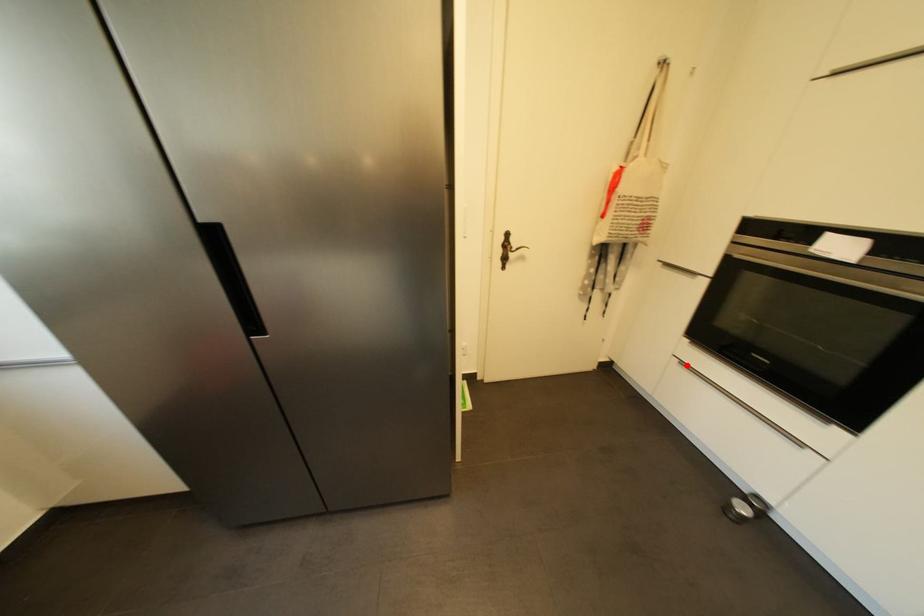
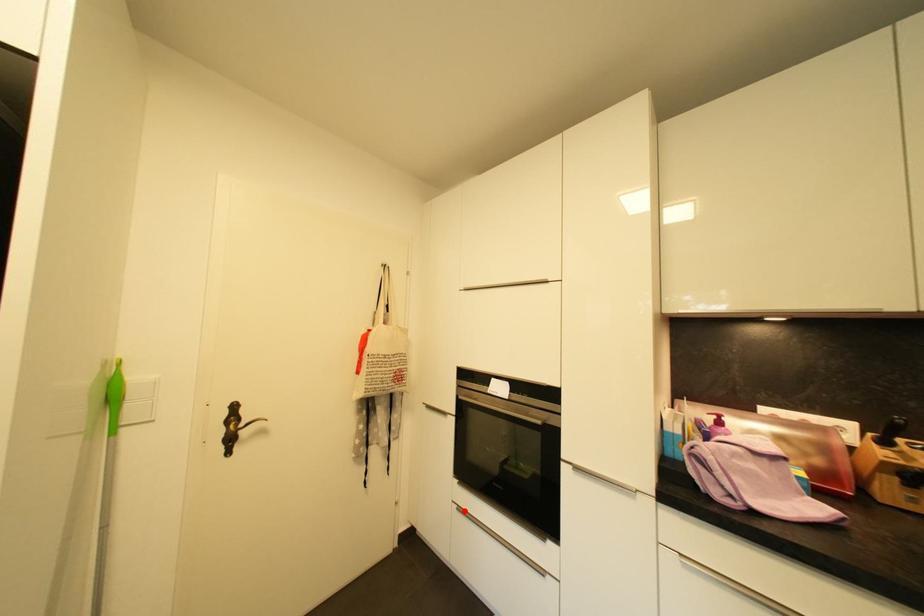
I am providing you with two images of the same scene from different viewpoints. A red point is marked on the first image and another point is marked on the second image. Is the red point in image1 aligned with the point shown in image2?

Yes